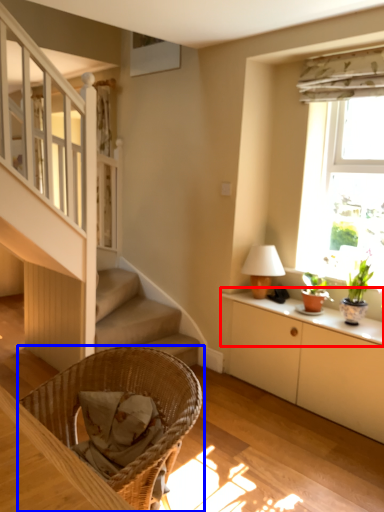
Question: Among these objects, which one is farthest to the camera, window sill (highlighted by a red box) or chair (highlighted by a blue box)?

Choices:
 (A) window sill
 (B) chair

Answer: (A)